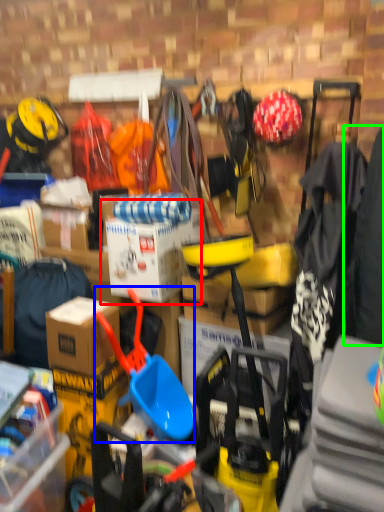
Question: Considering the real-world distances, which object is farthest from cardboard box (highlighted by a red box)? shovel (highlighted by a blue box) or clothing (highlighted by a green box)?

Choices:
 (A) shovel
 (B) clothing

Answer: (B)